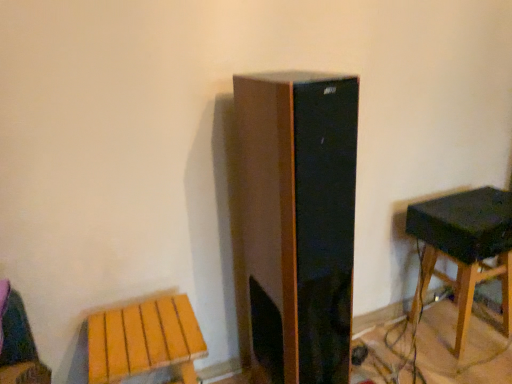
Question: Should I look upward or downward to see black matte speaker at right?

Choices:
 (A) up
 (B) down

Answer: (B)

Question: Is the position of wooden stool at lower left, the 2th stool in the right-to-left sequence, more distant than that of wooden stool at right, which ranks as the 1th stool in right-to-left order?

Choices:
 (A) yes
 (B) no

Answer: (B)

Question: Does wooden stool at lower left, which is the second stool in back-to-front order, have a smaller size compared to wooden stool at right, the 1th stool from the back?

Choices:
 (A) no
 (B) yes

Answer: (A)

Question: From a real-world perspective, is wooden stool at lower left, the first stool in the front-to-back sequence, on top of wooden stool at right, the second stool positioned from the front?

Choices:
 (A) yes
 (B) no

Answer: (A)

Question: From the image's perspective, does wooden stool at lower left, which is the second stool in back-to-front order, appear lower than wooden stool at right, the 1th stool from the back?

Choices:
 (A) no
 (B) yes

Answer: (B)

Question: Does wooden stool at lower left, which is counted as the 1th stool, starting from the left, have a greater height compared to wooden stool at right, which ranks as the 1th stool in right-to-left order?

Choices:
 (A) yes
 (B) no

Answer: (B)

Question: Can you confirm if wooden stool at lower left, which is the second stool in back-to-front order, is shorter than wooden stool at right, the 1th stool from the back?

Choices:
 (A) yes
 (B) no

Answer: (A)

Question: Is black matte speaker at right not within wooden stool at right, which ranks as the 1th stool in right-to-left order?

Choices:
 (A) yes
 (B) no

Answer: (A)

Question: Considering the relative sizes of black matte speaker at right and wooden stool at right, the 1th stool from the back, in the image provided, is black matte speaker at right thinner than wooden stool at right, the 1th stool from the back,?

Choices:
 (A) yes
 (B) no

Answer: (B)

Question: Does black matte speaker at right have a greater height compared to wooden stool at right, which ranks as the 1th stool in right-to-left order?

Choices:
 (A) no
 (B) yes

Answer: (A)

Question: Does black matte speaker at right come behind wooden stool at right, which ranks as the 1th stool in right-to-left order?

Choices:
 (A) yes
 (B) no

Answer: (B)

Question: From a real-world perspective, is black matte speaker at right on wooden stool at right, the 1th stool from the back?

Choices:
 (A) yes
 (B) no

Answer: (A)

Question: Does black matte speaker at right have a smaller size compared to wooden stool at right, the 2th stool when ordered from left to right?

Choices:
 (A) yes
 (B) no

Answer: (A)

Question: From a real-world perspective, is black matte speaker at right located beneath wooden stool at lower left, the first stool in the front-to-back sequence?

Choices:
 (A) no
 (B) yes

Answer: (A)